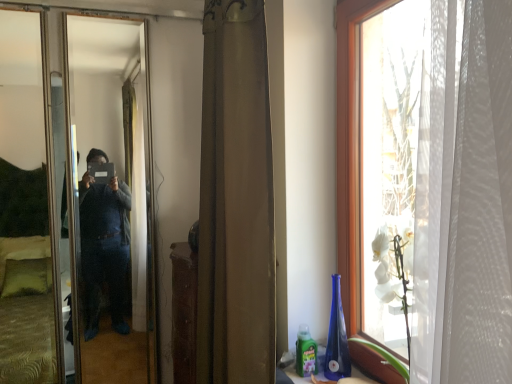
Question: Is metallic reflective mirror at left shorter than brown fabric curtain at center?

Choices:
 (A) no
 (B) yes

Answer: (A)

Question: Would you say brown fabric curtain at center is part of metallic reflective mirror at left's contents?

Choices:
 (A) yes
 (B) no

Answer: (B)

Question: Considering the relative sizes of metallic reflective mirror at left and brown fabric curtain at center in the image provided, is metallic reflective mirror at left smaller than brown fabric curtain at center?

Choices:
 (A) no
 (B) yes

Answer: (B)

Question: Does metallic reflective mirror at left come behind brown fabric curtain at center?

Choices:
 (A) no
 (B) yes

Answer: (B)

Question: Can you confirm if metallic reflective mirror at left is thinner than brown fabric curtain at center?

Choices:
 (A) yes
 (B) no

Answer: (A)

Question: Is metallic reflective mirror at left far away from brown fabric curtain at center?

Choices:
 (A) yes
 (B) no

Answer: (B)

Question: Is brown fabric curtain at center thinner than metallic reflective mirror at left?

Choices:
 (A) yes
 (B) no

Answer: (B)

Question: Is brown fabric curtain at center oriented towards metallic reflective mirror at left?

Choices:
 (A) yes
 (B) no

Answer: (B)

Question: Is brown fabric curtain at center next to metallic reflective mirror at left and touching it?

Choices:
 (A) no
 (B) yes

Answer: (A)

Question: Is there a large distance between brown fabric curtain at center and metallic reflective mirror at left?

Choices:
 (A) yes
 (B) no

Answer: (B)

Question: Is brown fabric curtain at center smaller than metallic reflective mirror at left?

Choices:
 (A) yes
 (B) no

Answer: (B)

Question: Is brown fabric curtain at center in front of metallic reflective mirror at left?

Choices:
 (A) yes
 (B) no

Answer: (A)

Question: Looking at the image, does brown fabric curtain at center seem bigger or smaller compared to metallic reflective mirror at left?

Choices:
 (A) big
 (B) small

Answer: (A)